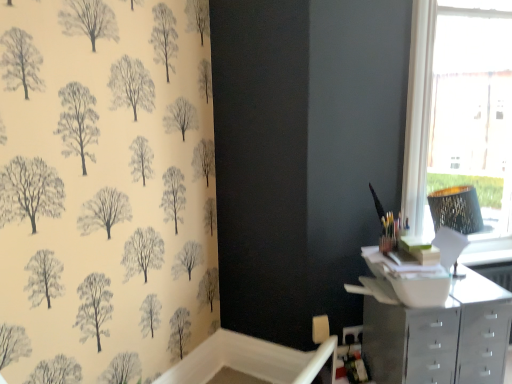
You are a GUI agent. You are given a task and a screenshot of the screen. Output one action in this format:
    pyautogui.click(x=<x>, y=<y>)
    Task: Click on the free spot above metallic silver chest of drawers at lower right (from a real-world perspective)
    
    Given the screenshot: What is the action you would take?
    pyautogui.click(x=473, y=293)